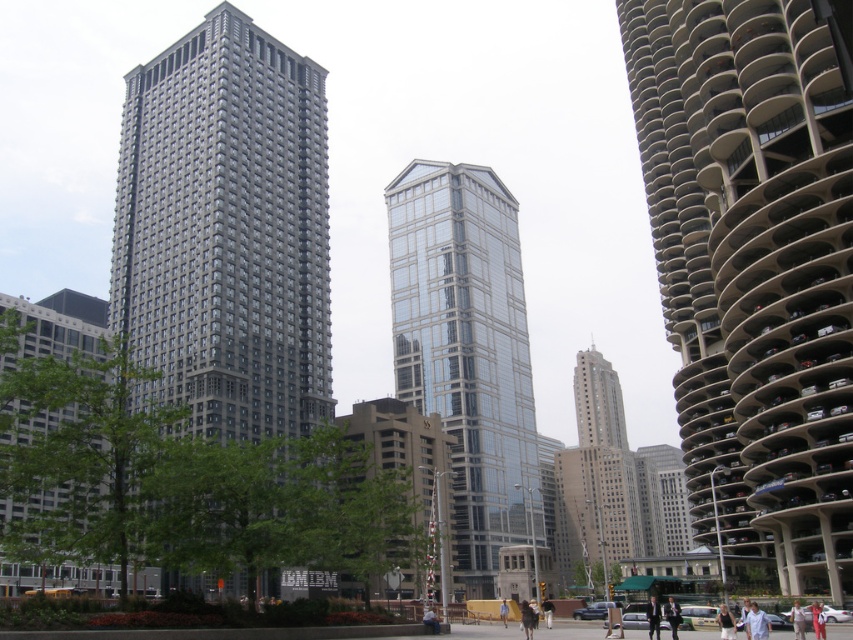
You are an architect analyzing the urban scene. You notice the glassy reflective skyscraper at center and the light blue denim jeans at lower right. Which object is taller in the image?

The glassy reflective skyscraper at center is much taller than the light blue denim jeans at lower right.

Looking at this image, you are a photographer standing in the urban scene and want to take a photo of both the dark suit at center and the dark brown leather jacket at center. Which one will appear shorter in the photo?

The dark suit at center will appear shorter in the photo because it is not as tall as the dark brown leather jacket at center.